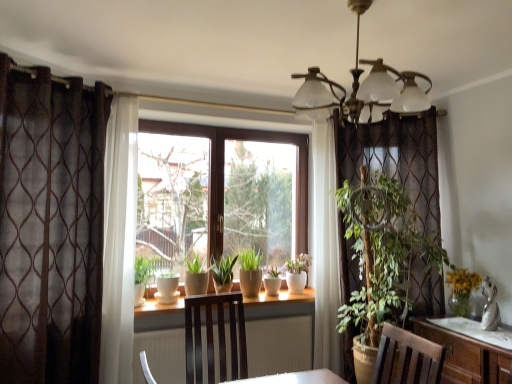
Question: From the image's perspective, relative to white ceramic pot at center, is matte ceramic pot at center, which is counted as the first flowerpot, starting from the left, above or below?

Choices:
 (A) above
 (B) below

Answer: (A)

Question: Is matte ceramic pot at center, positioned as the second flowerpot in right-to-left order, wider or thinner than white ceramic pot at center?

Choices:
 (A) thin
 (B) wide

Answer: (A)

Question: Which is farther from the brown sheer curtain at left?

Choices:
 (A) white ceramic flowerpot at center, the 1th flowerpot in the right-to-left sequence
 (B) metallic brass chandelier at upper center
 (C) white ceramic pot at center
 (D) matte ceramic pot at center, which is counted as the first flowerpot, starting from the left

Answer: (C)

Question: Based on their relative distances, which object is nearer to the white ceramic flowerpot at center, which ranks as the 2th flowerpot in left-to-right order?

Choices:
 (A) metallic brass chandelier at upper center
 (B) matte ceramic pot at center, which is counted as the first flowerpot, starting from the left
 (C) brown sheer curtain at left
 (D) white ceramic pot at center

Answer: (B)